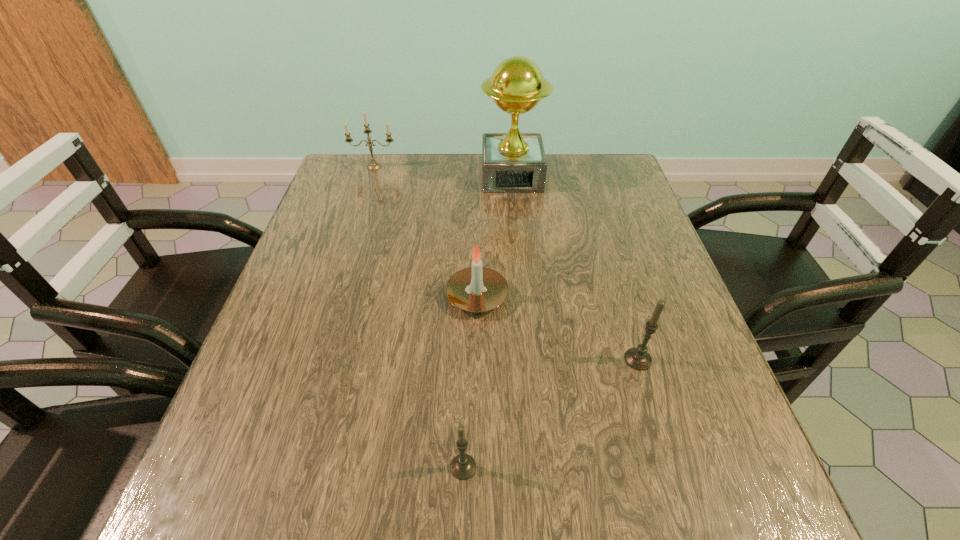
At what (x,y) coordinates should I click in order to perform the action: click on the tallest object. Please return your answer as a coordinate pair (x, y). This screenshot has width=960, height=540. Looking at the image, I should click on [513, 162].

The height and width of the screenshot is (540, 960). Identify the location of the farthest candle. (373, 166).

You are a GUI agent. You are given a task and a screenshot of the screen. Output one action in this format:
    pyautogui.click(x=<x>, y=<y>)
    Task: Click on the leftmost candle
    The width and height of the screenshot is (960, 540).
    Given the screenshot: What is the action you would take?
    pyautogui.click(x=373, y=166)

In order to click on the second nearest candle in this screenshot , I will do `click(638, 358)`.

Where is `the rightmost candle`? This screenshot has width=960, height=540. the rightmost candle is located at coordinates (638, 358).

Locate an element on the screen. Image resolution: width=960 pixels, height=540 pixels. the second farthest candle is located at coordinates (474, 289).

Where is `the nearest candle`? This screenshot has height=540, width=960. the nearest candle is located at coordinates (463, 466).

At what (x,y) coordinates should I click in order to perform the action: click on free space located 0.350m on the front-facing side of the tallest object. Please return your answer as a coordinate pair (x, y). Looking at the image, I should click on (522, 288).

The width and height of the screenshot is (960, 540). Identify the location of vacant space located 0.050m on the front of the leftmost candle. (370, 180).

This screenshot has height=540, width=960. In order to click on vacant space located 0.320m on the left of the fourth farthest object in this screenshot , I will do `click(452, 359)`.